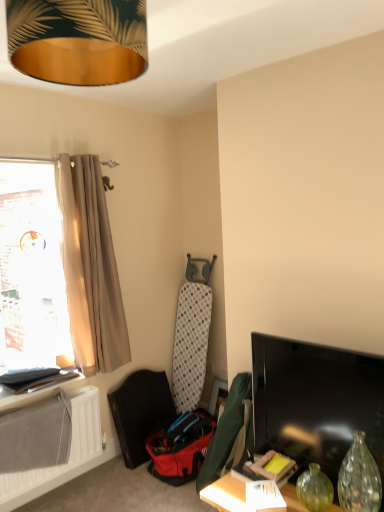
This screenshot has height=512, width=384. I want to click on free space above white matte radiator at lower left (from a real-world perspective), so click(x=37, y=402).